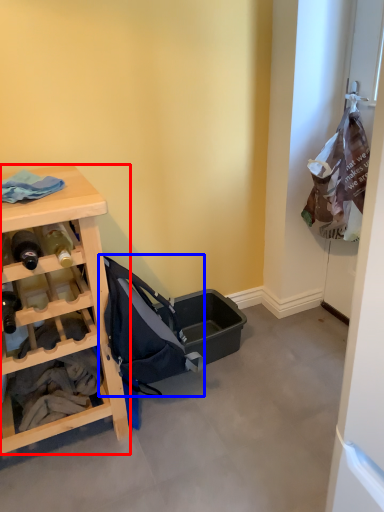
Question: Which object appears farthest to the camera in this image, desk (highlighted by a red box) or baby carriage (highlighted by a blue box)?

Choices:
 (A) desk
 (B) baby carriage

Answer: (B)